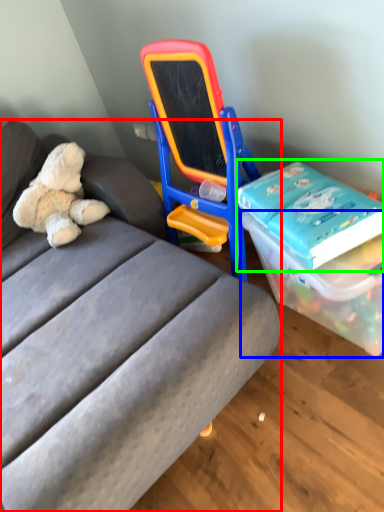
Question: Which object is positioned closest to studio couch (highlighted by a red box)? Select from box (highlighted by a blue box) and book (highlighted by a green box).

Choices:
 (A) box
 (B) book

Answer: (A)